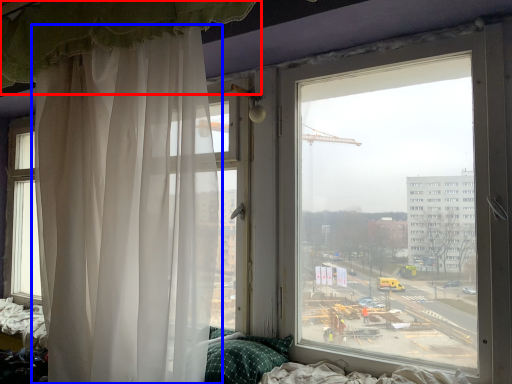
Question: Which object appears farthest to the camera in this image, curtain (highlighted by a red box) or curtain (highlighted by a blue box)?

Choices:
 (A) curtain
 (B) curtain

Answer: (B)